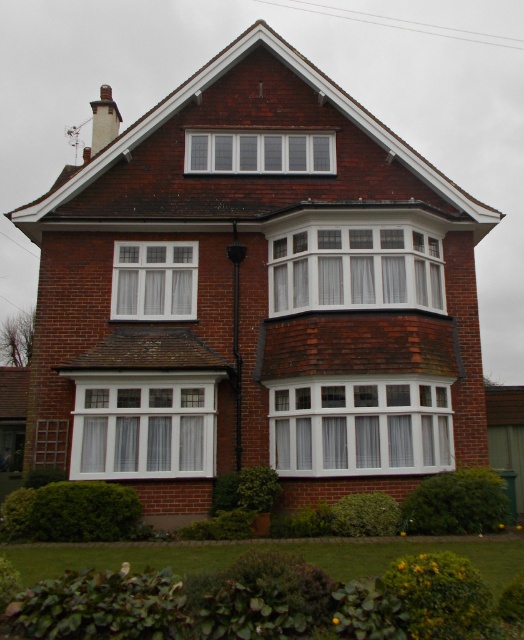
You are a window installer assessing the house. You need to determine if the white textured bay window at center can accommodate a new wider decorative trim that requires the window to be at least 2 meters wide. The white glass window at center is known to be 1.5 meters wide. Can the bay window accommodate the trim?

The white textured bay window at center might be wider than the white glass window at center, which is 1.5 meters wide. Therefore, the bay window could potentially accommodate the new decorative trim if it meets or exceeds the 2 meter width requirement.

You are standing in front of the house and want to look at the windows. Which window is positioned lower down on the house, the white wood window at center or the white glass window at upper center?

The white wood window at center is positioned lower than the white glass window at upper center.